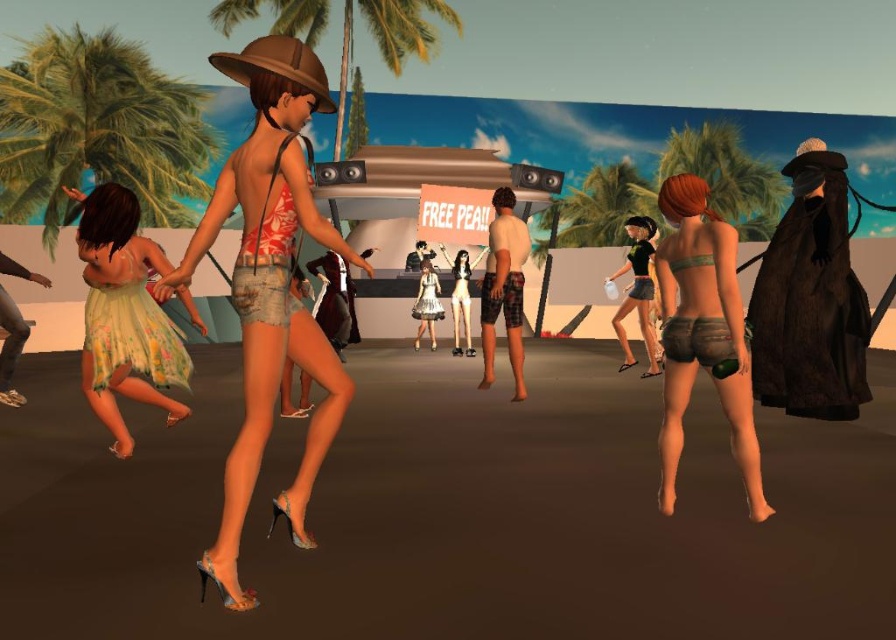
Question: Which is nearer to the brown leather shorts at right?

Choices:
 (A) floral chiffon dress at lower left
 (B) green leafy palm tree at upper center

Answer: (A)

Question: From the image, what is the correct spatial relationship of brown leather shorts at right in relation to matte black shorts at center?

Choices:
 (A) above
 (B) below

Answer: (B)

Question: Which point is farther from the camera taking this photo?

Choices:
 (A) (309, 112)
 (B) (587, 228)
 (C) (423, 33)
 (D) (42, 192)

Answer: (C)

Question: Which point is closer to the camera?

Choices:
 (A) pos(115,234)
 (B) pos(389,36)
 (C) pos(0,120)

Answer: (A)

Question: Does shiny metallic shorts at center appear on the left side of matte black shorts at center?

Choices:
 (A) no
 (B) yes

Answer: (B)

Question: In this image, where is green leafy palm tree at left located relative to brown leather shorts at right?

Choices:
 (A) left
 (B) right

Answer: (A)